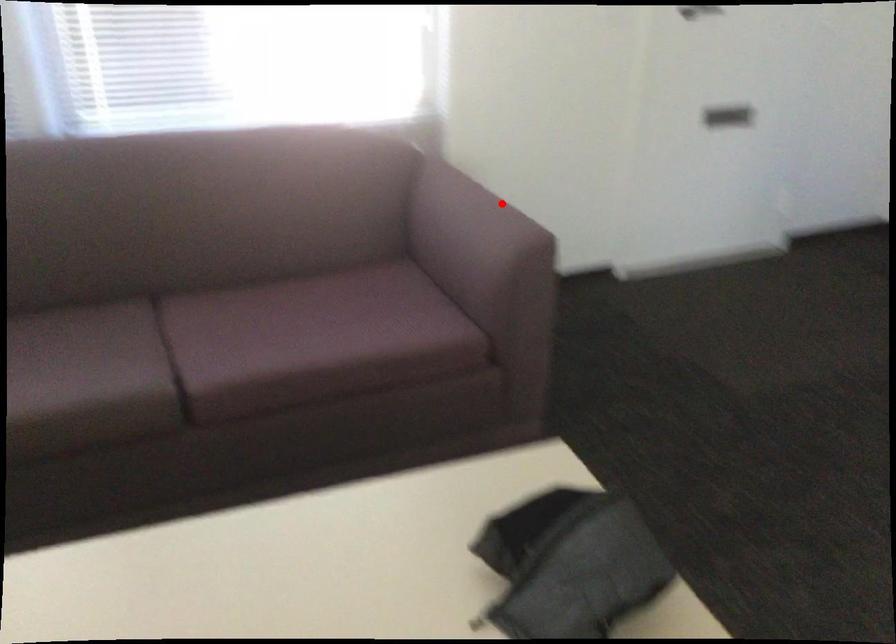
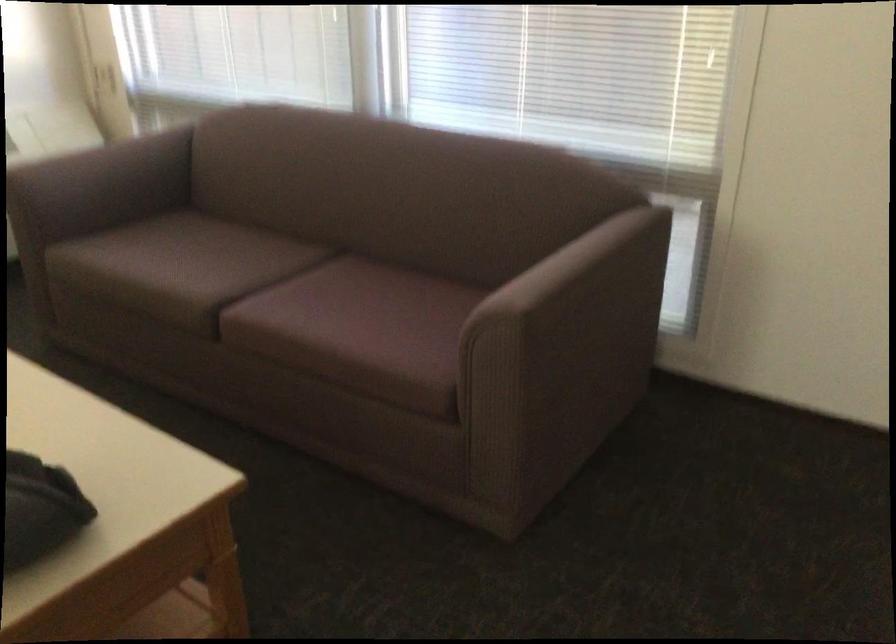
In the second image, find the point that corresponds to the highlighted location in the first image.

(579, 265)